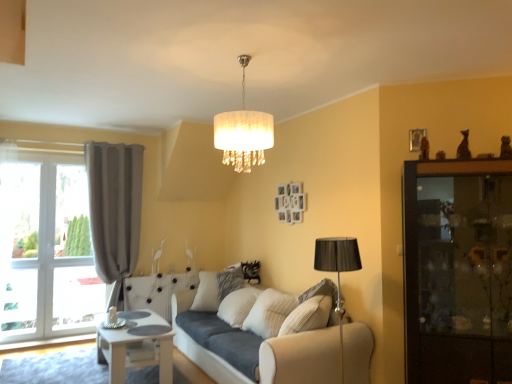
Question: Is white fabric lampshade at center outside of matte gray curtain at left?

Choices:
 (A) no
 (B) yes

Answer: (B)

Question: Are white fabric lampshade at center and matte gray curtain at left making contact?

Choices:
 (A) no
 (B) yes

Answer: (A)

Question: Is white fabric lampshade at center turned away from matte gray curtain at left?

Choices:
 (A) no
 (B) yes

Answer: (A)

Question: From a real-world perspective, is white fabric lampshade at center on top of matte gray curtain at left?

Choices:
 (A) no
 (B) yes

Answer: (B)

Question: Is white fabric lampshade at center thinner than matte gray curtain at left?

Choices:
 (A) no
 (B) yes

Answer: (A)

Question: Is white fabric lampshade at center further to the viewer compared to matte gray curtain at left?

Choices:
 (A) yes
 (B) no

Answer: (B)

Question: Is dark wood cabinet at right to the right of beige fabric couch at center from the viewer's perspective?

Choices:
 (A) no
 (B) yes

Answer: (B)

Question: From the image's perspective, is dark wood cabinet at right above beige fabric couch at center?

Choices:
 (A) no
 (B) yes

Answer: (B)

Question: From a real-world perspective, is dark wood cabinet at right located beneath beige fabric couch at center?

Choices:
 (A) yes
 (B) no

Answer: (B)

Question: Is dark wood cabinet at right taller than beige fabric couch at center?

Choices:
 (A) no
 (B) yes

Answer: (B)

Question: Is dark wood cabinet at right oriented away from beige fabric couch at center?

Choices:
 (A) no
 (B) yes

Answer: (A)

Question: Can we say dark wood cabinet at right lies outside beige fabric couch at center?

Choices:
 (A) yes
 (B) no

Answer: (A)

Question: Is dark wood cabinet at right outside white fabric lampshade at center?

Choices:
 (A) no
 (B) yes

Answer: (B)